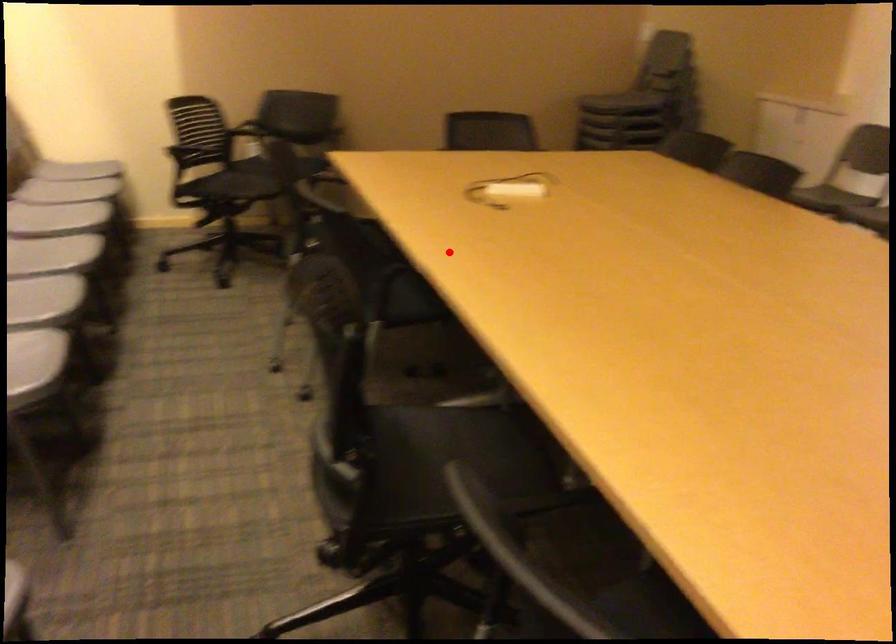
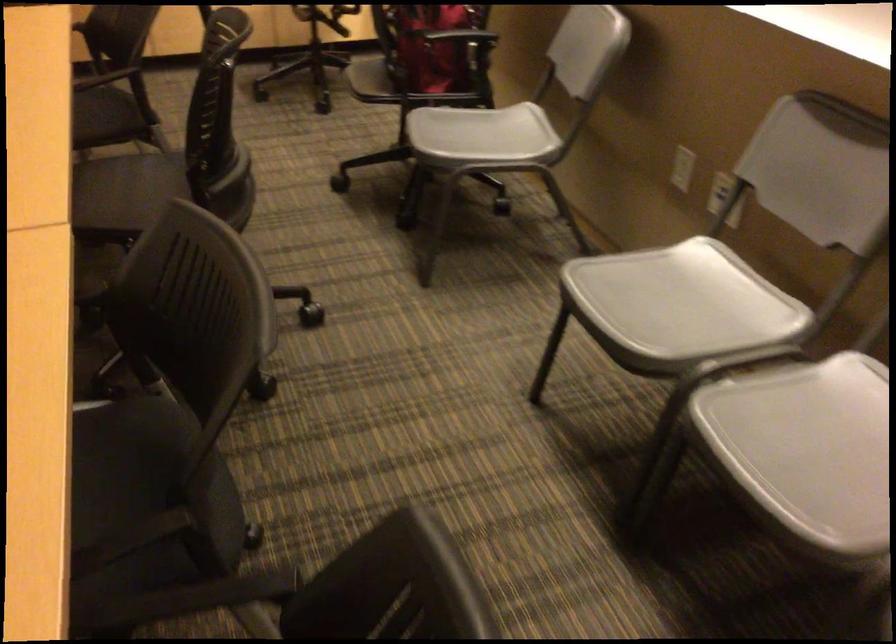
Locate, in the second image, the point that corresponds to the highlighted location in the first image.

(130, 427)